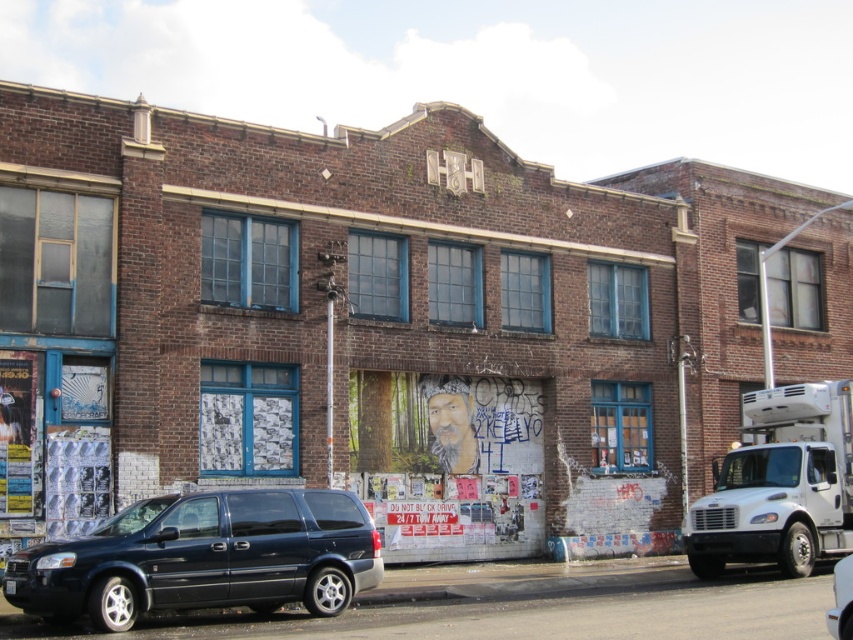
You are a delivery driver who needs to park your vehicle between the matte black minivan at lower left and the white metallic truck at right. Is there enough space between them to fit your 2.5 meter wide delivery van?

The matte black minivan at lower left is to the left of white metallic truck at right, but the distance between them is not specified. Without knowing the exact spacing, it is impossible to determine if your 2.5 meter wide delivery van can fit between them.